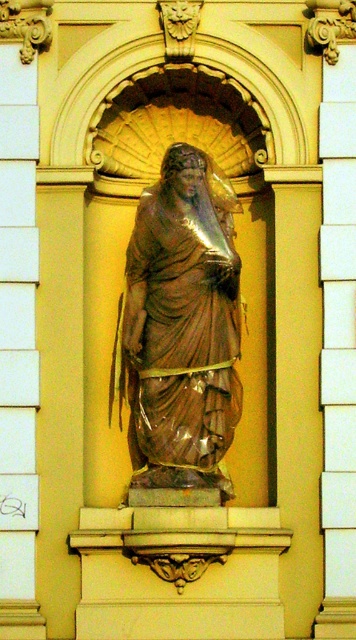
Is white marble pillar at left taller than white stone pillar at right?

Incorrect, white marble pillar at left's height is not larger of white stone pillar at right's.

Does white marble pillar at left have a larger size compared to white stone pillar at right?

Yes, white marble pillar at left is bigger than white stone pillar at right.

Between point (27, 520) and point (342, 68), which one is positioned in front?

Point (27, 520) is in front.

In order to click on white marble pillar at left in this screenshot , I will do `click(18, 346)`.

Can you confirm if bronze statue at center is thinner than white stone pillar at right?

No, bronze statue at center is not thinner than white stone pillar at right.

Based on the photo, which is above, bronze statue at center or white stone pillar at right?

Positioned higher is bronze statue at center.

What do you see at coordinates (180, 326) in the screenshot? Image resolution: width=356 pixels, height=640 pixels. I see `bronze statue at center` at bounding box center [180, 326].

Identify the location of bronze statue at center. This screenshot has width=356, height=640. (180, 326).

From the picture: Does bronze statue at center have a smaller size compared to white marble pillar at left?

Incorrect, bronze statue at center is not smaller in size than white marble pillar at left.

Who is lower down, bronze statue at center or white marble pillar at left?

white marble pillar at left is below.

Between point (185, 364) and point (14, 77), which one is positioned behind?

The point (14, 77) is more distant.

At what (x,y) coordinates should I click in order to perform the action: click on bronze statue at center. Please return your answer as a coordinate pair (x, y). Looking at the image, I should click on (180, 326).